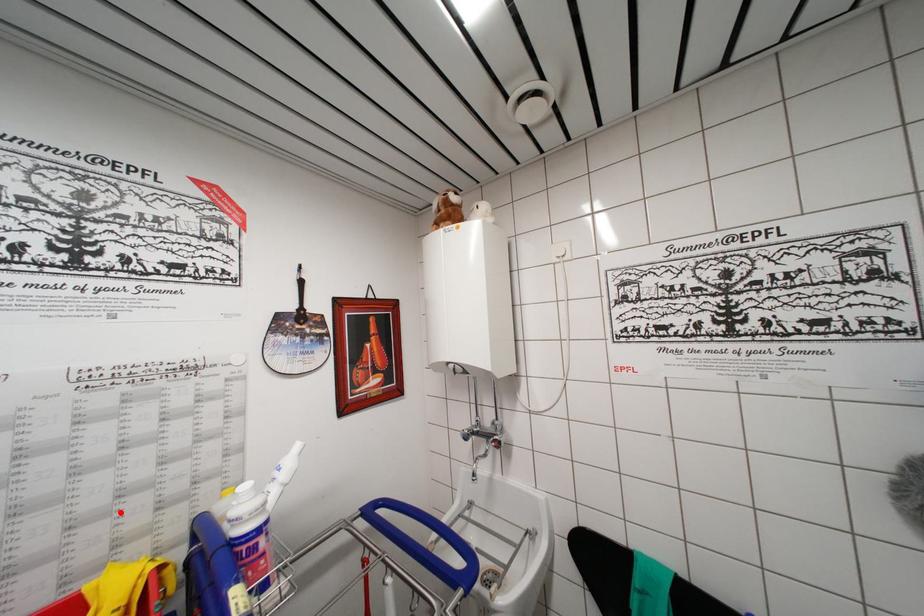
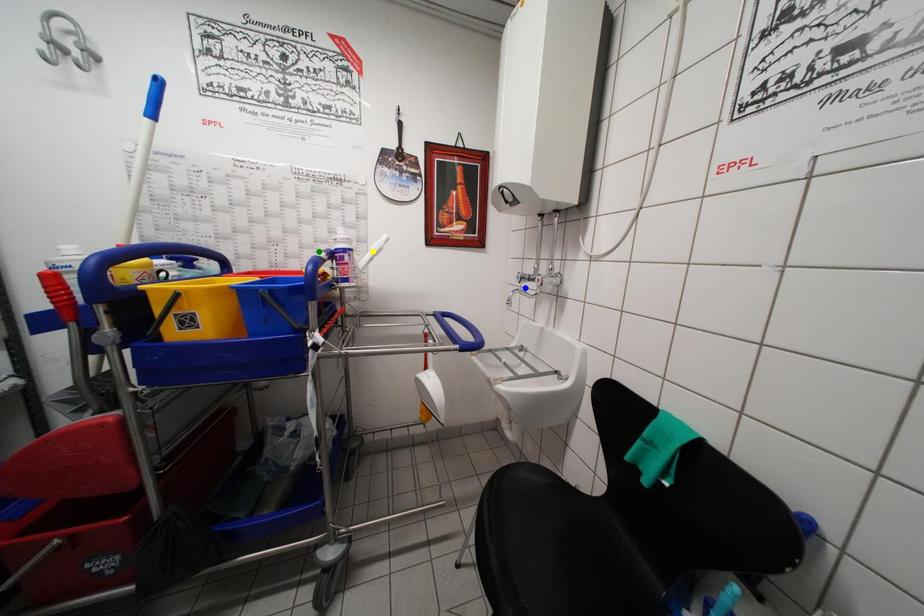
Question: I am providing you with two images of the same scene from different viewpoints. A red point is marked on the first image. You are given multiple points on the second image. Which point in image 2 represents the same 3d spot as the red point in image 1?

Choices:
 (A) yellow point
 (B) blue point
 (C) green point

Answer: (C)